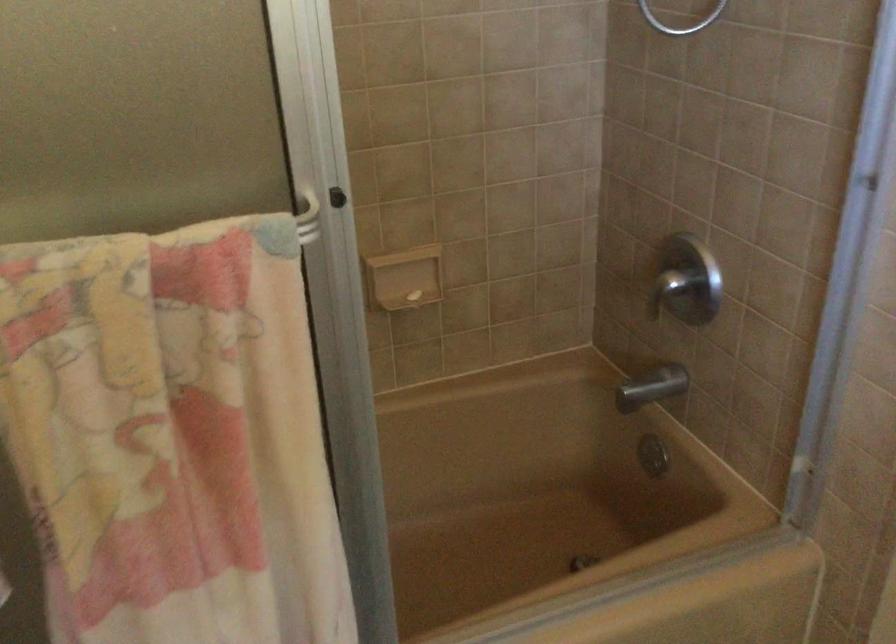
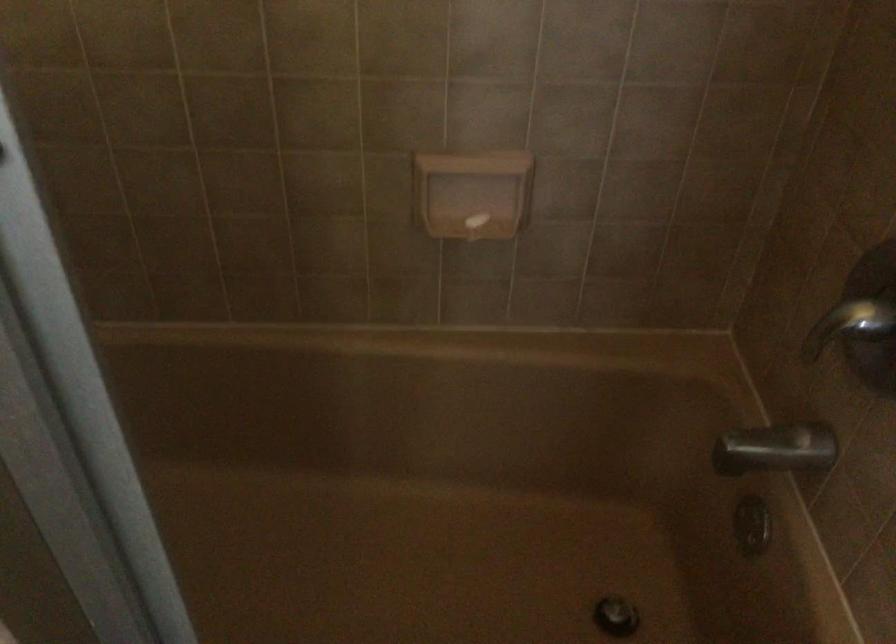
In the second image, find the point that corresponds to (x=655, y=388) in the first image.

(776, 449)